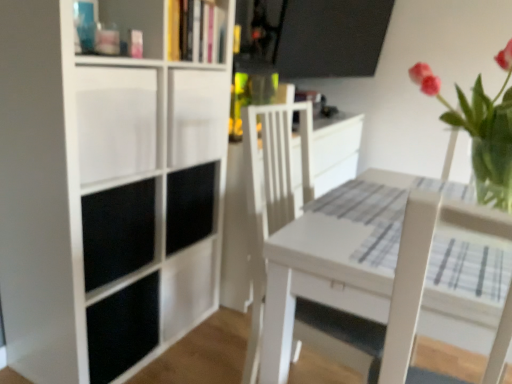
This screenshot has height=384, width=512. Identify the location of vacant space situated above white wood table at center (from a real-world perspective). (378, 218).